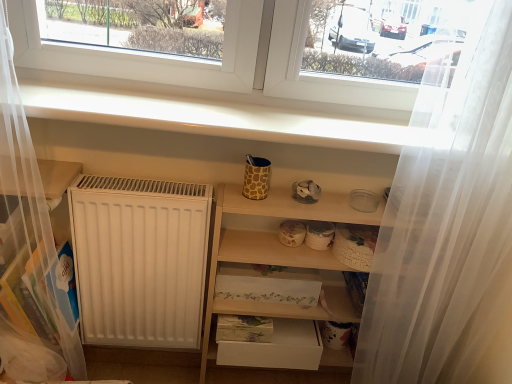
Find the location of a particular element. This screenshot has height=384, width=512. vacant space situated above white matte drawer at lower center (from a real-world perspective) is located at coordinates (271, 326).